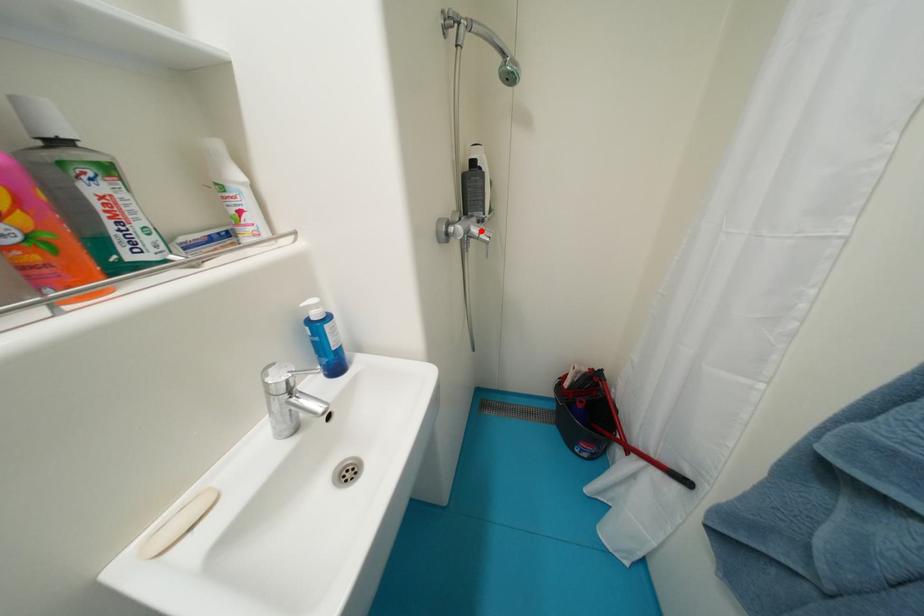
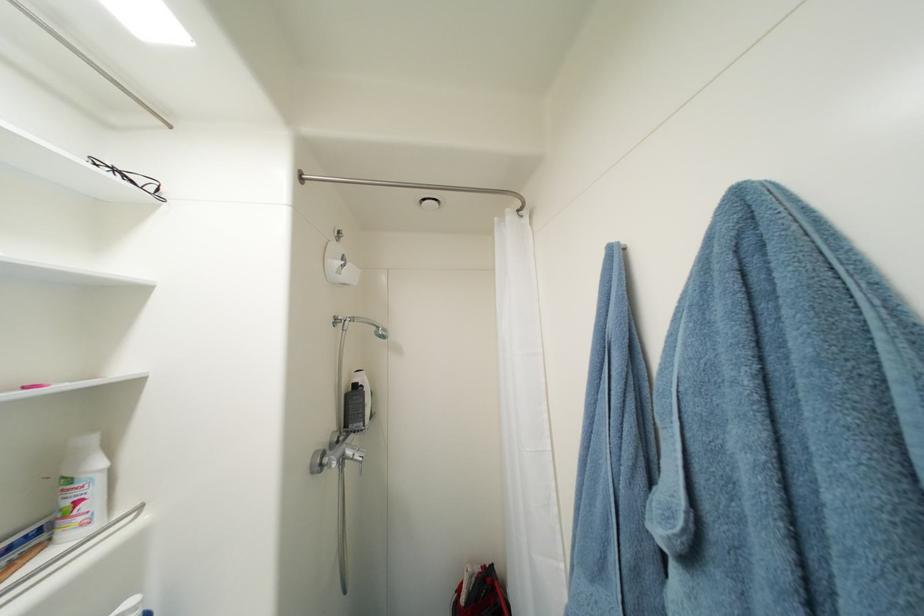
Locate, in the second image, the point that corresponds to the highlighted location in the first image.

(356, 454)